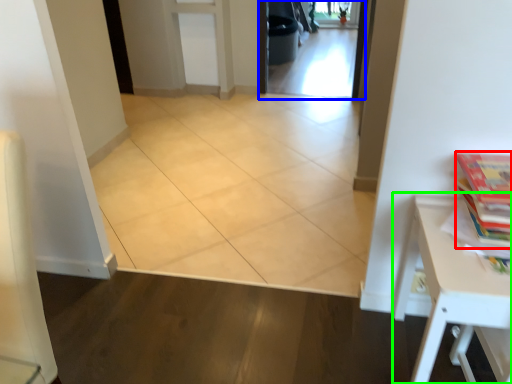
Question: Which object is the farthest from book (highlighted by a red box)? Choose among these: screen door (highlighted by a blue box) or table (highlighted by a green box).

Choices:
 (A) screen door
 (B) table

Answer: (A)